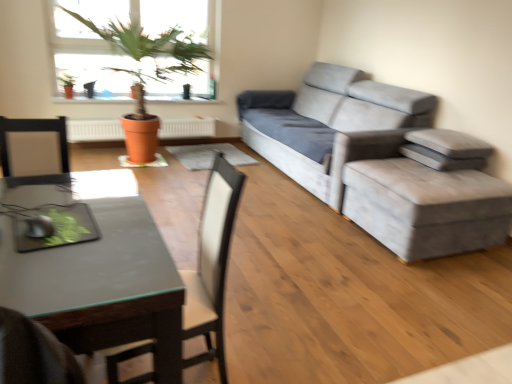
Where is `white plastic radiator at lower center`? white plastic radiator at lower center is located at coordinates (94, 130).

The width and height of the screenshot is (512, 384). What do you see at coordinates (67, 83) in the screenshot? I see `matte terracotta pot at upper left, marked as the second houseplant in a right-to-left arrangement` at bounding box center [67, 83].

Measure the distance between point (68, 80) and camera.

The distance of point (68, 80) from camera is 4.45 meters.

The height and width of the screenshot is (384, 512). Describe the element at coordinates (375, 162) in the screenshot. I see `velvet grey couch at right` at that location.

The image size is (512, 384). What do you see at coordinates (439, 158) in the screenshot?
I see `gray fabric pillow at right, placed as the 2th pillow when sorted from top to bottom` at bounding box center [439, 158].

Locate an element on the screen. This screenshot has height=384, width=512. gray fabric pillow at right, marked as the 1th pillow in a bottom-to-top arrangement is located at coordinates (439, 158).

The width and height of the screenshot is (512, 384). Describe the element at coordinates (137, 91) in the screenshot. I see `terracotta clay pot at upper left` at that location.

The height and width of the screenshot is (384, 512). What do you see at coordinates (450, 143) in the screenshot? I see `gray fabric pillow at right, which ranks as the 2th pillow in bottom-to-top order` at bounding box center [450, 143].

Find the location of a particular element. This screenshot has width=512, height=384. white plastic radiator at lower center is located at coordinates (94, 130).

From the image's perspective, is white plastic radiator at lower center located beneath gray fabric pillow at right, placed as the 2th pillow when sorted from top to bottom?

No.

Is point (178, 133) behind point (429, 149)?

Yes.

From a real-world perspective, is white plastic radiator at lower center above or below gray fabric pillow at right, marked as the 1th pillow in a bottom-to-top arrangement?

From a real-world perspective, white plastic radiator at lower center is physically below gray fabric pillow at right, marked as the 1th pillow in a bottom-to-top arrangement.

Is white plastic radiator at lower center behind gray fabric pillow at right, placed as the 2th pillow when sorted from top to bottom?

Yes.

Can you confirm if black glass desk at lower left is taller than velvet grey stool at right?

Indeed, black glass desk at lower left has a greater height compared to velvet grey stool at right.

Can we say black glass desk at lower left lies outside velvet grey stool at right?

Yes, black glass desk at lower left is located beyond the bounds of velvet grey stool at right.

Which point is more distant from viewer, (143, 231) or (492, 221)?

The point (492, 221) is farther from the camera.

Considering the relative sizes of terracotta pot at upper left, the first houseplant in the front-to-back sequence, and white plastic radiator at lower center in the image provided, is terracotta pot at upper left, the first houseplant in the front-to-back sequence, wider than white plastic radiator at lower center?

Yes, terracotta pot at upper left, the first houseplant in the front-to-back sequence, is wider than white plastic radiator at lower center.

Is terracotta pot at upper left, the 1th houseplant when ordered from right to left, not near white plastic radiator at lower center?

No, terracotta pot at upper left, the 1th houseplant when ordered from right to left, is not far from white plastic radiator at lower center.

In terms of size, does terracotta pot at upper left, which ranks as the first houseplant in bottom-to-top order, appear bigger or smaller than white plastic radiator at lower center?

terracotta pot at upper left, which ranks as the first houseplant in bottom-to-top order, is bigger than white plastic radiator at lower center.

Does terracotta pot at upper left, which is the 2th houseplant in top-to-bottom order, turn towards white plastic radiator at lower center?

No, terracotta pot at upper left, which is the 2th houseplant in top-to-bottom order, is not aimed at white plastic radiator at lower center.

Which object is more forward, gray fabric pillow at right, which ranks as the 1th pillow in top-to-bottom order, or black leather swivel chair at center?

black leather swivel chair at center is closer to the camera.

Is gray fabric pillow at right, which ranks as the 1th pillow in top-to-bottom order, outside of black leather swivel chair at center?

Absolutely, gray fabric pillow at right, which ranks as the 1th pillow in top-to-bottom order, is external to black leather swivel chair at center.

Find the location of a particular element. The width and height of the screenshot is (512, 384). swivel chair below the gray fabric pillow at right, which ranks as the 1th pillow in top-to-bottom order (from a real-world perspective) is located at coordinates (212, 263).

Does point (436, 148) appear closer or farther from the camera than point (205, 236)?

Point (436, 148) appears to be farther away from the viewer than point (205, 236).

How much distance is there between gray fabric pillow at right, placed as the 2th pillow when sorted from top to bottom, and terracotta clay pot at upper left?

gray fabric pillow at right, placed as the 2th pillow when sorted from top to bottom, and terracotta clay pot at upper left are 9.56 feet apart from each other.

From a real-world perspective, which object rests below the other?

→ gray fabric pillow at right, marked as the 1th pillow in a bottom-to-top arrangement, is physically lower.

Identify the location of pillow that is the 1st one when counting forward from the terracotta clay pot at upper left. Image resolution: width=512 pixels, height=384 pixels. (439, 158).

Does point (408, 152) come farther from viewer compared to point (135, 99)?

That is False.

From a real-world perspective, does black leather swivel chair at center stand above terracotta pot at upper left, which ranks as the first houseplant in bottom-to-top order?

No, from a real-world perspective, black leather swivel chair at center is not above terracotta pot at upper left, which ranks as the first houseplant in bottom-to-top order.

Consider the image. From the image's perspective, does black leather swivel chair at center appear higher than terracotta pot at upper left, which is the second houseplant in left-to-right order?

No, from the image's perspective, black leather swivel chair at center is not above terracotta pot at upper left, which is the second houseplant in left-to-right order.

Identify the location of houseplant that is the 1st object located behind the black leather swivel chair at center. This screenshot has width=512, height=384. (149, 48).

Can you confirm if black leather swivel chair at center is shorter than terracotta pot at upper left, which is the 2th houseplant in top-to-bottom order?

Yes.

Can you confirm if gray fabric pillow at right, placed as the 2th pillow when sorted from top to bottom, is thinner than terracotta pot at upper left, the 1th houseplant when ordered from right to left?

Correct, the width of gray fabric pillow at right, placed as the 2th pillow when sorted from top to bottom, is less than that of terracotta pot at upper left, the 1th houseplant when ordered from right to left.

From a real-world perspective, does gray fabric pillow at right, placed as the 2th pillow when sorted from top to bottom, sit lower than terracotta pot at upper left, the second houseplant when ordered from back to front?

Yes, from a real-world perspective, gray fabric pillow at right, placed as the 2th pillow when sorted from top to bottom, is beneath terracotta pot at upper left, the second houseplant when ordered from back to front.

From the image's perspective, is gray fabric pillow at right, placed as the 2th pillow when sorted from top to bottom, on terracotta pot at upper left, which is the 2th houseplant in top-to-bottom order?

No, from the image's perspective, gray fabric pillow at right, placed as the 2th pillow when sorted from top to bottom, is not over terracotta pot at upper left, which is the 2th houseplant in top-to-bottom order.

What's the angular difference between gray fabric pillow at right, placed as the 2th pillow when sorted from top to bottom, and terracotta pot at upper left, the first houseplant in the front-to-back sequence,'s facing directions?

89.8 degrees.

You are a GUI agent. You are given a task and a screenshot of the screen. Output one action in this format:
    pyautogui.click(x=<x>, y=<y>)
    Task: Click on the 1st pillow in front when counting from the white plastic radiator at lower center
    The image size is (512, 384).
    Given the screenshot: What is the action you would take?
    [439, 158]

The image size is (512, 384). I want to click on stool behind the black glass desk at lower left, so click(x=426, y=207).

Looking at the image, which one is located closer to gray fabric pillow at right, marked as the 1th pillow in a bottom-to-top arrangement, terracotta pot at upper left, the second houseplant when ordered from back to front, or matte terracotta pot at upper left, arranged as the first houseplant when viewed from the left?

terracotta pot at upper left, the second houseplant when ordered from back to front.

Looking at the image, which one is located closer to terracotta pot at upper left, the second houseplant when ordered from back to front, gray fabric pillow at right, which ranks as the 2th pillow in bottom-to-top order, or black leather swivel chair at center?

gray fabric pillow at right, which ranks as the 2th pillow in bottom-to-top order, is closer to terracotta pot at upper left, the second houseplant when ordered from back to front.

When comparing their distances from black leather swivel chair at center, does terracotta pot at upper left, which is the second houseplant in left-to-right order, or velvet grey stool at right seem further?

terracotta pot at upper left, which is the second houseplant in left-to-right order.

When comparing their distances from gray fabric pillow at right, placed as the 2th pillow when sorted from top to bottom, does matte terracotta pot at upper left, marked as the second houseplant in a right-to-left arrangement, or white plastic radiator at lower center seem closer?

The object closer to gray fabric pillow at right, placed as the 2th pillow when sorted from top to bottom, is white plastic radiator at lower center.

Looking at this image, based on their spatial positions, is terracotta pot at upper left, which is the 2th houseplant in top-to-bottom order, or velvet grey stool at right closer to black glass desk at lower left?

Among the two, velvet grey stool at right is located nearer to black glass desk at lower left.

From the image, which object appears to be farther from gray fabric pillow at right, marked as the 1th pillow in a bottom-to-top arrangement, gray fabric pillow at right, which ranks as the 1th pillow in top-to-bottom order, or matte terracotta pot at upper left, positioned as the 2th houseplant in front-to-back order?

matte terracotta pot at upper left, positioned as the 2th houseplant in front-to-back order.

Based on the photo, which object lies further to the anchor point matte terracotta pot at upper left, arranged as the first houseplant when viewed from the left, velvet grey couch at right or white plastic radiator at lower center?

The object further to matte terracotta pot at upper left, arranged as the first houseplant when viewed from the left, is velvet grey couch at right.

Which object lies further to the anchor point velvet grey couch at right, matte terracotta pot at upper left, placed as the 1th houseplant when sorted from back to front, or black glass desk at lower left?

Among the two, matte terracotta pot at upper left, placed as the 1th houseplant when sorted from back to front, is located further to velvet grey couch at right.

Find the location of `radiator located between terracotta clay pot at upper left and gray fabric pillow at right, which ranks as the 1th pillow in top-to-bottom order, in the left-right direction`. radiator located between terracotta clay pot at upper left and gray fabric pillow at right, which ranks as the 1th pillow in top-to-bottom order, in the left-right direction is located at coordinates (94, 130).

This screenshot has height=384, width=512. Identify the location of stool between velvet grey couch at right and gray fabric pillow at right, marked as the 1th pillow in a bottom-to-top arrangement. (426, 207).

Where is `studio couch between black glass desk at lower left and gray fabric pillow at right, placed as the 2th pillow when sorted from top to bottom, from front to back`? This screenshot has width=512, height=384. studio couch between black glass desk at lower left and gray fabric pillow at right, placed as the 2th pillow when sorted from top to bottom, from front to back is located at coordinates (375, 162).

Where is `stool between white plastic radiator at lower center and gray fabric pillow at right, which ranks as the 1th pillow in top-to-bottom order, from left to right`? stool between white plastic radiator at lower center and gray fabric pillow at right, which ranks as the 1th pillow in top-to-bottom order, from left to right is located at coordinates (426, 207).